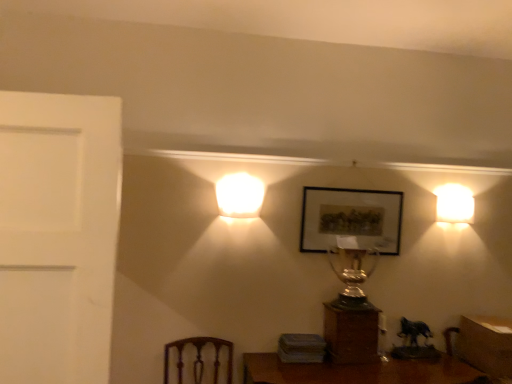
Question: Is matte black picture frame at center bigger or smaller than wooden table at lower right?

Choices:
 (A) big
 (B) small

Answer: (B)

Question: From the image's perspective, is matte black picture frame at center positioned above or below wooden table at lower right?

Choices:
 (A) above
 (B) below

Answer: (A)

Question: Which is nearer to the wooden table at lower right?

Choices:
 (A) white glossy lampshade at center, the first lamp when ordered from front to back
 (B) matte black picture frame at center
 (C) wooden trophy at center
 (D) shiny gold trophy at center
 (E) white glossy wall sconce at right, which ranks as the second lamp in front-to-back order

Answer: (C)

Question: Which object is positioned farthest from the white glossy wall sconce at right, which appears as the 2th lamp when viewed from the left?

Choices:
 (A) white glossy lampshade at center, the first lamp when ordered from front to back
 (B) shiny gold trophy at center
 (C) wooden trophy at center
 (D) matte black picture frame at center
 (E) wooden table at lower right

Answer: (A)